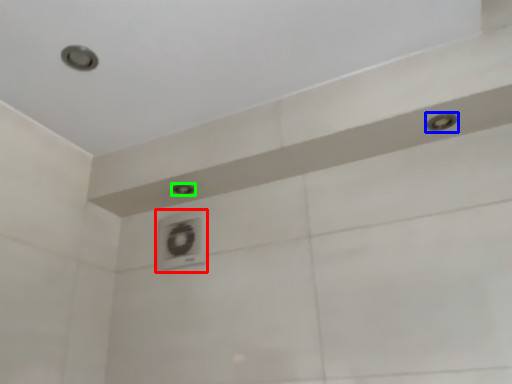
Question: Which object is the closest to the air conditioner (highlighted by a red box)? Choose among these: shower (highlighted by a blue box) or shower (highlighted by a green box).

Choices:
 (A) shower
 (B) shower

Answer: (B)